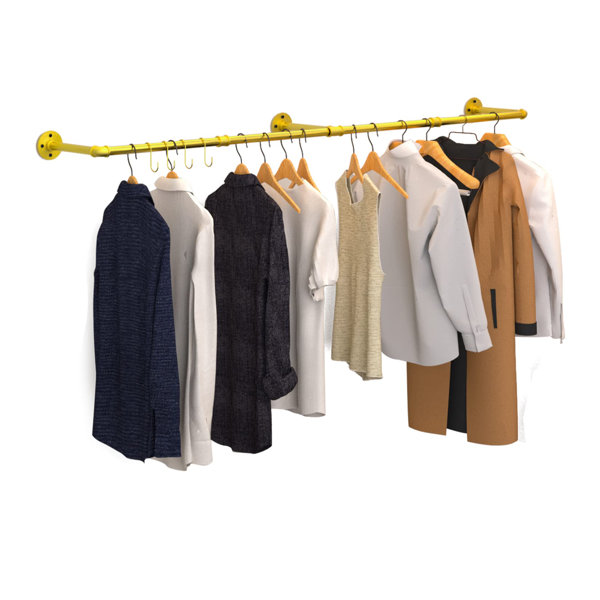
Image resolution: width=600 pixels, height=600 pixels. I want to click on clothing items hanging on a bar, so click(x=137, y=291), click(x=184, y=248), click(x=261, y=248), click(x=315, y=236), click(x=362, y=236), click(x=411, y=241), click(x=517, y=224), click(x=540, y=224).